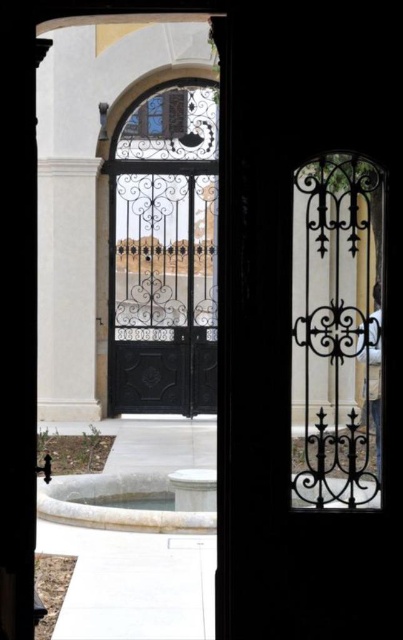
Question: Is the position of black wrought iron gate at center less distant than that of white marble fountain at lower center?

Choices:
 (A) yes
 (B) no

Answer: (B)

Question: Which object appears farthest from the camera in this image?

Choices:
 (A) black wrought iron gate at center
 (B) white marble fountain at lower center

Answer: (A)

Question: Can you confirm if black wrought iron gate at center is positioned to the right of white marble fountain at lower center?

Choices:
 (A) yes
 (B) no

Answer: (A)

Question: Can you confirm if black wrought iron gate at center is positioned to the left of white marble fountain at lower center?

Choices:
 (A) yes
 (B) no

Answer: (B)

Question: Among these objects, which one is farthest from the camera?

Choices:
 (A) black wrought iron gate at center
 (B) white marble fountain at lower center

Answer: (A)